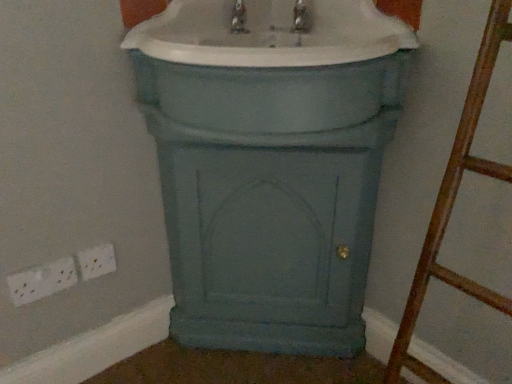
Describe the element at coordinates (270, 64) in the screenshot. I see `matte blue cabinet at center` at that location.

Locate an element on the screen. The width and height of the screenshot is (512, 384). matte blue cabinet at center is located at coordinates (270, 64).

The width and height of the screenshot is (512, 384). Describe the element at coordinates (96, 261) in the screenshot. I see `white plastic electric outlet at lower left, the first electric outlet positioned from the right` at that location.

Measure the distance between white plastic electric outlet at lower left, the first electric outlet positioned from the right, and camera.

3.38 feet.

Measure the distance between matte blue cabinet at center and camera.

A distance of 70.50 centimeters exists between matte blue cabinet at center and camera.

In order to click on matte blue cabinet at center in this screenshot , I will do `click(270, 64)`.

Can you confirm if matte blue cabinet at center is wider than matte blue cabinet at center?

Incorrect, the width of matte blue cabinet at center does not surpass that of matte blue cabinet at center.

Is matte blue cabinet at center positioned beyond the bounds of matte blue cabinet at center?

Yes.

Based on the photo, from the image's perspective, which object appears higher, matte blue cabinet at center or matte blue cabinet at center?

matte blue cabinet at center, from the image's perspective.

Is white plastic electric outlet at lower left, the 2th electric outlet when ordered from left to right, facing towards matte blue cabinet at center?

No, white plastic electric outlet at lower left, the 2th electric outlet when ordered from left to right, does not turn towards matte blue cabinet at center.

From the image's perspective, between white plastic electric outlet at lower left, the first electric outlet positioned from the right, and matte blue cabinet at center, which one is located above?

matte blue cabinet at center.

Is white plastic electric outlet at lower left, the 2th electric outlet when ordered from left to right, spatially inside matte blue cabinet at center, or outside of it?

white plastic electric outlet at lower left, the 2th electric outlet when ordered from left to right, is located beyond the bounds of matte blue cabinet at center.

From a real-world perspective, who is located higher, white plastic electric outlet at lower left, the 2th electric outlet when ordered from left to right, or matte blue cabinet at center?

In real-world perspective, matte blue cabinet at center is above.

How different are the orientations of white plastic electric outlet at lower left, the 2th electric outlet when ordered from left to right, and white plastic socket at lower left, which ranks as the 2th electric outlet in right-to-left order, in degrees?

1.46 degrees.

From the image's perspective, which is above, white plastic electric outlet at lower left, the first electric outlet positioned from the right, or white plastic socket at lower left, which ranks as the 2th electric outlet in right-to-left order?

white plastic electric outlet at lower left, the first electric outlet positioned from the right, is shown above in the image.

Considering the sizes of objects white plastic electric outlet at lower left, the first electric outlet positioned from the right, and white plastic socket at lower left, which ranks as the 2th electric outlet in right-to-left order, in the image provided, who is taller, white plastic electric outlet at lower left, the first electric outlet positioned from the right, or white plastic socket at lower left, which ranks as the 2th electric outlet in right-to-left order,?

white plastic electric outlet at lower left, the first electric outlet positioned from the right.

Between white plastic electric outlet at lower left, the 2th electric outlet when ordered from left to right, and white plastic socket at lower left, which ranks as the 2th electric outlet in right-to-left order, which one has larger width?

white plastic socket at lower left, which ranks as the 2th electric outlet in right-to-left order, is wider.

Which point is more forward, (255,31) or (18,284)?

The point (18,284) is closer.

Find the location of a particular element. electric outlet that is the 1st one when counting backward from the matte blue cabinet at center is located at coordinates (42, 281).

Does matte blue cabinet at center have a greater width compared to white plastic socket at lower left, the 1th electric outlet in the left-to-right sequence?

Indeed, matte blue cabinet at center has a greater width compared to white plastic socket at lower left, the 1th electric outlet in the left-to-right sequence.

Does matte blue cabinet at center have a greater width compared to matte blue cabinet at center?

Yes, matte blue cabinet at center is wider than matte blue cabinet at center.

Between matte blue cabinet at center and matte blue cabinet at center, which one has more height?

With more height is matte blue cabinet at center.

This screenshot has height=384, width=512. In order to click on sink in front of the matte blue cabinet at center in this screenshot , I will do `click(270, 64)`.

Is matte blue cabinet at center aimed at matte blue cabinet at center?

No, matte blue cabinet at center is not turned towards matte blue cabinet at center.

Consider the image. Which is correct: white plastic electric outlet at lower left, the 2th electric outlet when ordered from left to right, is inside matte blue cabinet at center, or outside of it?

white plastic electric outlet at lower left, the 2th electric outlet when ordered from left to right, is located beyond the bounds of matte blue cabinet at center.

From the image's perspective, does white plastic electric outlet at lower left, the first electric outlet positioned from the right, appear higher than matte blue cabinet at center?

Actually, white plastic electric outlet at lower left, the first electric outlet positioned from the right, appears below matte blue cabinet at center in the image.

Considering the relative sizes of white plastic electric outlet at lower left, the first electric outlet positioned from the right, and matte blue cabinet at center in the image provided, is white plastic electric outlet at lower left, the first electric outlet positioned from the right, shorter than matte blue cabinet at center?

Indeed, white plastic electric outlet at lower left, the first electric outlet positioned from the right, has a lesser height compared to matte blue cabinet at center.

Locate an element on the screen. Image resolution: width=512 pixels, height=384 pixels. porcelain in front of the white plastic electric outlet at lower left, the 2th electric outlet when ordered from left to right is located at coordinates (270, 171).

Would you say matte blue cabinet at center is inside or outside white plastic electric outlet at lower left, the first electric outlet positioned from the right?

matte blue cabinet at center is located beyond the bounds of white plastic electric outlet at lower left, the first electric outlet positioned from the right.

Could you tell me if matte blue cabinet at center is facing white plastic electric outlet at lower left, the first electric outlet positioned from the right?

No, matte blue cabinet at center is not turned towards white plastic electric outlet at lower left, the first electric outlet positioned from the right.

The height and width of the screenshot is (384, 512). I want to click on sink to the right of white plastic electric outlet at lower left, the first electric outlet positioned from the right, so click(x=270, y=64).

In terms of size, does matte blue cabinet at center appear bigger or smaller than white plastic electric outlet at lower left, the 2th electric outlet when ordered from left to right?

matte blue cabinet at center is bigger than white plastic electric outlet at lower left, the 2th electric outlet when ordered from left to right.

Locate an element on the screen. The width and height of the screenshot is (512, 384). porcelain behind the matte blue cabinet at center is located at coordinates (270, 171).

What are the coordinates of `sink located on the right of white plastic electric outlet at lower left, the first electric outlet positioned from the right` in the screenshot? It's located at (270, 64).

Estimate the real-world distances between objects in this image. Which object is further from matte blue cabinet at center, white plastic electric outlet at lower left, the 2th electric outlet when ordered from left to right, or white plastic socket at lower left, which ranks as the 2th electric outlet in right-to-left order?

white plastic socket at lower left, which ranks as the 2th electric outlet in right-to-left order, lies further to matte blue cabinet at center than the other object.

Based on their spatial positions, is matte blue cabinet at center or white plastic socket at lower left, which ranks as the 2th electric outlet in right-to-left order, closer to matte blue cabinet at center?

The object closer to matte blue cabinet at center is matte blue cabinet at center.

Considering their positions, is white plastic socket at lower left, which ranks as the 2th electric outlet in right-to-left order, positioned further to white plastic electric outlet at lower left, the 2th electric outlet when ordered from left to right, than matte blue cabinet at center?

matte blue cabinet at center lies further to white plastic electric outlet at lower left, the 2th electric outlet when ordered from left to right, than the other object.

Based on their spatial positions, is matte blue cabinet at center or white plastic electric outlet at lower left, the first electric outlet positioned from the right, closer to matte blue cabinet at center?

Result: matte blue cabinet at center is positioned closer to the anchor matte blue cabinet at center.

Estimate the real-world distances between objects in this image. Which object is closer to white plastic socket at lower left, which ranks as the 2th electric outlet in right-to-left order, matte blue cabinet at center or matte blue cabinet at center?

matte blue cabinet at center is closer to white plastic socket at lower left, which ranks as the 2th electric outlet in right-to-left order.

Based on the photo, based on their spatial positions, is white plastic electric outlet at lower left, the 2th electric outlet when ordered from left to right, or matte blue cabinet at center closer to matte blue cabinet at center?

matte blue cabinet at center lies closer to matte blue cabinet at center than the other object.

Which object lies nearer to the anchor point matte blue cabinet at center, white plastic socket at lower left, the 1th electric outlet in the left-to-right sequence, or white plastic electric outlet at lower left, the 2th electric outlet when ordered from left to right?

white plastic electric outlet at lower left, the 2th electric outlet when ordered from left to right, is positioned closer to the anchor matte blue cabinet at center.

Looking at the image, which one is located closer to matte blue cabinet at center, white plastic electric outlet at lower left, the first electric outlet positioned from the right, or white plastic socket at lower left, the 1th electric outlet in the left-to-right sequence?

white plastic electric outlet at lower left, the first electric outlet positioned from the right, lies closer to matte blue cabinet at center than the other object.

Identify the location of electric outlet between matte blue cabinet at center and white plastic socket at lower left, the 1th electric outlet in the left-to-right sequence, vertically. (96, 261).

Find the location of a particular element. The width and height of the screenshot is (512, 384). electric outlet situated between white plastic socket at lower left, the 1th electric outlet in the left-to-right sequence, and matte blue cabinet at center from left to right is located at coordinates (96, 261).

Image resolution: width=512 pixels, height=384 pixels. In order to click on porcelain situated between white plastic socket at lower left, which ranks as the 2th electric outlet in right-to-left order, and matte blue cabinet at center from left to right in this screenshot , I will do `click(270, 171)`.

The image size is (512, 384). I want to click on porcelain located between matte blue cabinet at center and white plastic electric outlet at lower left, the first electric outlet positioned from the right, in the depth direction, so click(x=270, y=171).